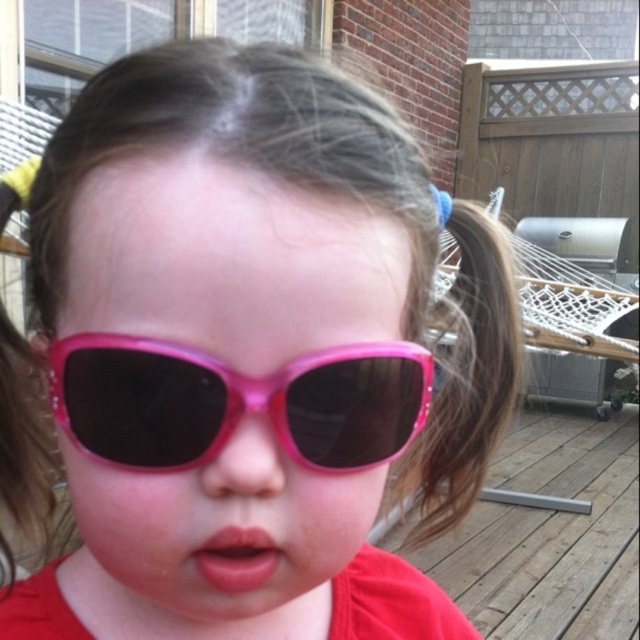
The child is wearing sunglasses and has glossy lips. From the perspective of someone facing the child, which object is located to the left of the other? The options are the pink plastic sunglasses at center and the pink glossy lips at center.

The pink glossy lips at center are located to the left of the pink plastic sunglasses at center because the sunglasses are on the right side of the lips.

The child is trying to take a selfie with a phone. The phone has a front camera that can capture objects up to 15 cm wide. The pink plastic sunglasses at center and pink glossy lips at center are both in the frame. Which object might not fit entirely within the camera view if the phone is held at a standard distance?

The pink plastic sunglasses at center might not fit entirely within the camera view because they are wider than the pink glossy lips at center, and the camera can only capture up to 15 cm wide objects.